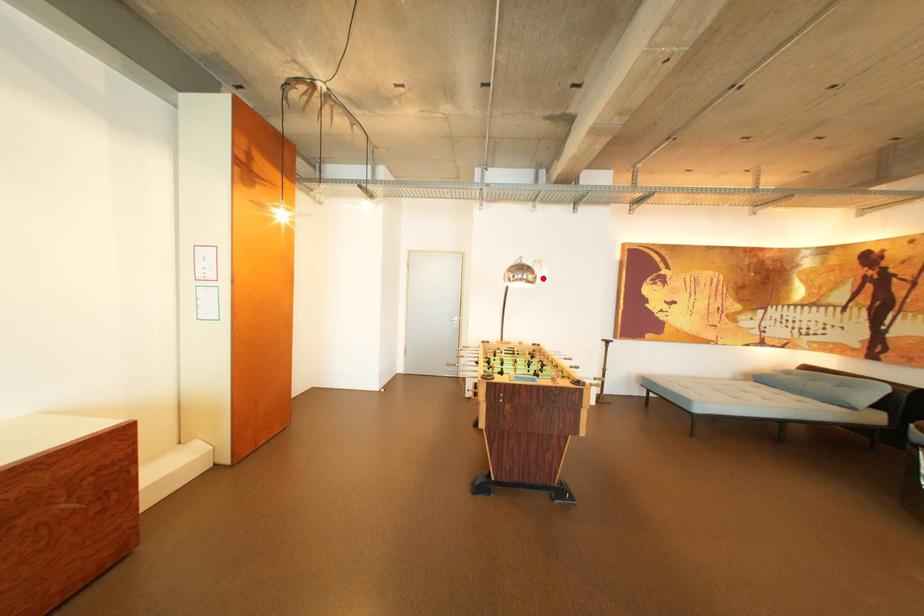
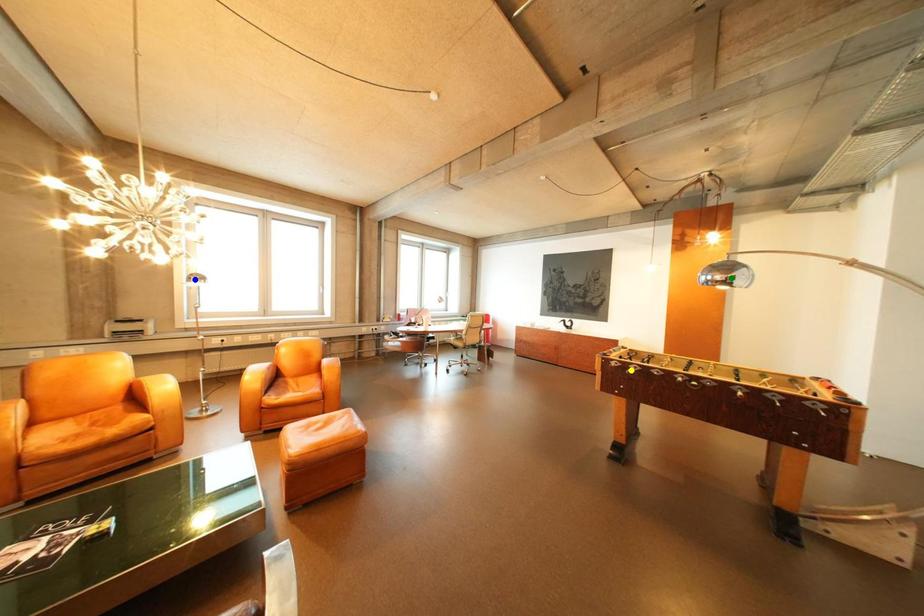
Question: I am providing you with two images of the same scene from different viewpoints. A red point is marked on the first image. You are given multiple points on the second image. Can you choose the point in image 2 that corresponds to the point in image 1?

Choices:
 (A) yellow point
 (B) green point
 (C) blue point

Answer: (B)